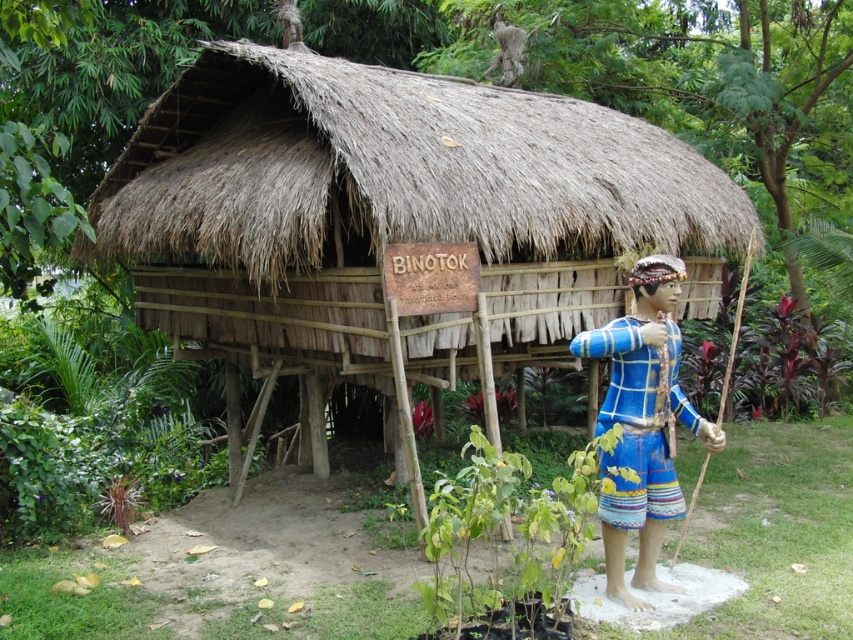
Question: Which object appears closest to the camera in this image?

Choices:
 (A) blue woven fabric at right
 (B) thatched wood hut at center

Answer: (A)

Question: Does thatched wood hut at center have a lesser width compared to blue woven fabric at right?

Choices:
 (A) no
 (B) yes

Answer: (B)

Question: Is thatched wood hut at center to the left of blue woven fabric at right from the viewer's perspective?

Choices:
 (A) no
 (B) yes

Answer: (B)

Question: Is the position of thatched wood hut at center less distant than that of blue woven fabric at right?

Choices:
 (A) no
 (B) yes

Answer: (A)